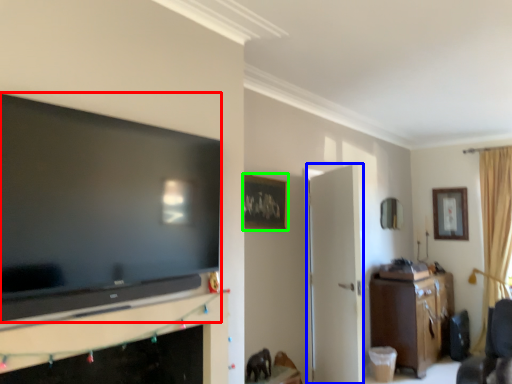
Question: Considering the real-world distances, which object is closest to television (highlighted by a red box)? door (highlighted by a blue box) or picture frame (highlighted by a green box).

Choices:
 (A) door
 (B) picture frame

Answer: (B)